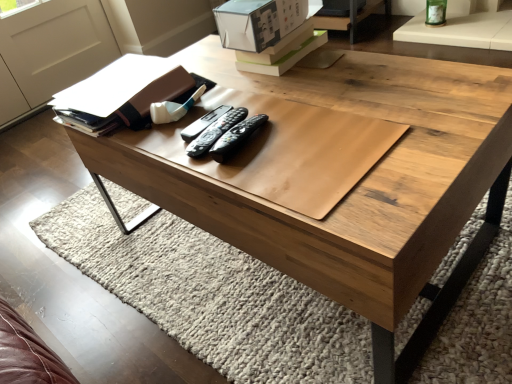
Identify the location of blank area to the left of black plastic remote at center, marked as the 1th remote in a left-to-right arrangement. The image size is (512, 384). (x=154, y=143).